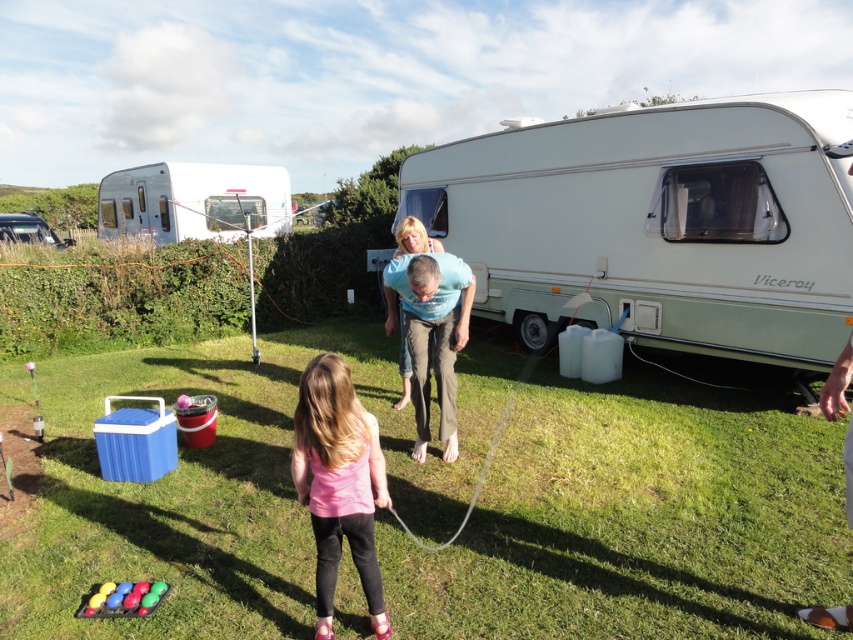
Question: Does pink matte tank top at center have a larger size compared to metallic silver trailer at upper left?

Choices:
 (A) no
 (B) yes

Answer: (A)

Question: Observing the image, what is the correct spatial positioning of green grass at center in reference to pink matte tank top at center?

Choices:
 (A) below
 (B) above

Answer: (A)

Question: Among these objects, which one is farthest from the camera?

Choices:
 (A) white plastic recreational vehicle at center
 (B) green grass at center
 (C) white plastic recreational vehicle at upper center
 (D) pink matte tank top at center

Answer: (C)

Question: Does green grass at center have a smaller size compared to blue cotton shirt at center?

Choices:
 (A) yes
 (B) no

Answer: (A)

Question: Which object is farther from the camera taking this photo?

Choices:
 (A) white plastic recreational vehicle at center
 (B) metallic silver trailer at upper left

Answer: (B)

Question: Which point is closer to the camera?

Choices:
 (A) metallic silver trailer at upper left
 (B) blue cotton shirt at center
 (C) white plastic recreational vehicle at center

Answer: (B)